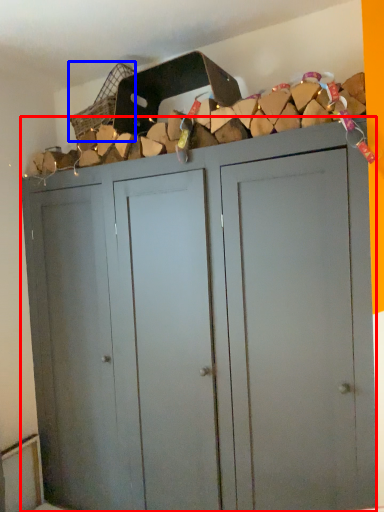
Question: Which point is closer to the camera, cupboard (highlighted by a red box) or basket (highlighted by a blue box)?

Choices:
 (A) cupboard
 (B) basket

Answer: (A)